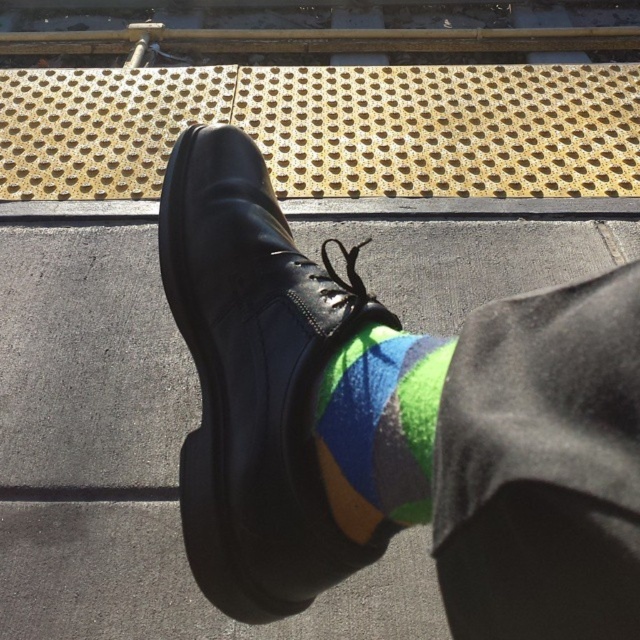
Question: Observing the image, what is the correct spatial positioning of black leather shoe at center in reference to multicolored felt sock at center?

Choices:
 (A) right
 (B) left

Answer: (B)

Question: Can you confirm if black leather shoe at center is positioned below multicolored felt sock at center?

Choices:
 (A) yes
 (B) no

Answer: (B)

Question: Is black leather shoe at center to the left of multicolored felt sock at center from the viewer's perspective?

Choices:
 (A) yes
 (B) no

Answer: (A)

Question: Which point is farther from the camera taking this photo?

Choices:
 (A) (168, 196)
 (B) (417, 493)

Answer: (A)

Question: Which object is closer to the camera taking this photo?

Choices:
 (A) multicolored felt sock at center
 (B) black leather shoe at center

Answer: (A)

Question: Among these points, which one is farthest from the camera?

Choices:
 (A) (301, 342)
 (B) (356, 516)

Answer: (A)